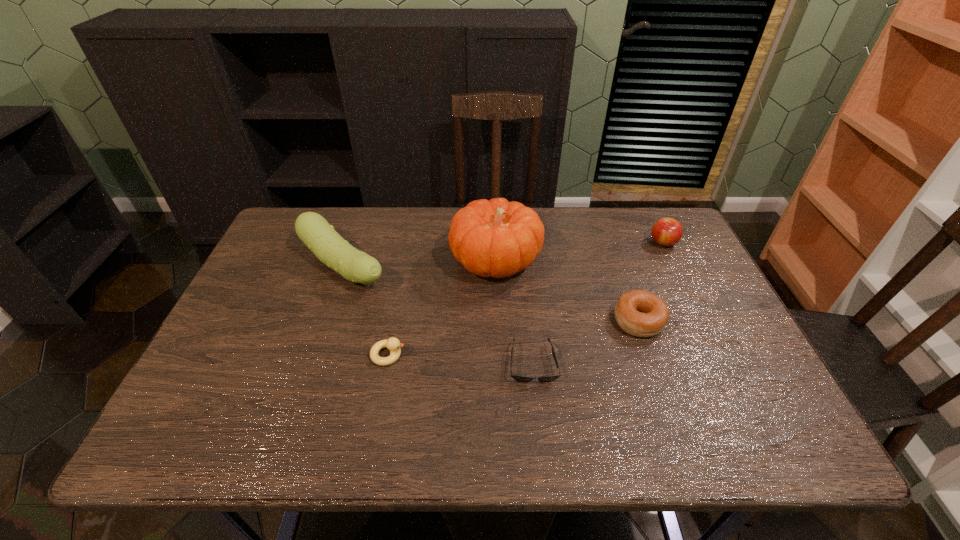
You are a GUI agent. You are given a task and a screenshot of the screen. Output one action in this format:
    pyautogui.click(x=<x>, y=<y>)
    Task: Click on the vacant area situated on the left of the apple
    
    Given the screenshot: What is the action you would take?
    pyautogui.click(x=563, y=242)

Where is `vacant position located 0.150m on the front of the bagel`? This screenshot has height=540, width=960. vacant position located 0.150m on the front of the bagel is located at coordinates (664, 394).

Locate an element on the screen. Image resolution: width=960 pixels, height=540 pixels. vacant area located 0.110m at the beak of the duckling is located at coordinates [x=451, y=355].

At what (x,y) coordinates should I click in order to perform the action: click on free spot located 0.100m on the front-facing side of the shortest object. Please return your answer as a coordinate pair (x, y). Looking at the image, I should click on (540, 427).

Identify the location of pumpkin present at the far edge. (497, 238).

Find the location of a particular element. The height and width of the screenshot is (540, 960). cucumber that is at the far edge is located at coordinates (317, 234).

The image size is (960, 540). I want to click on apple located in the far edge section of the desktop, so click(x=666, y=232).

Locate an element on the screen. object that is at the left edge is located at coordinates (317, 234).

Where is `object present at the right edge`? object present at the right edge is located at coordinates (666, 232).

I want to click on object that is at the far left corner, so click(317, 234).